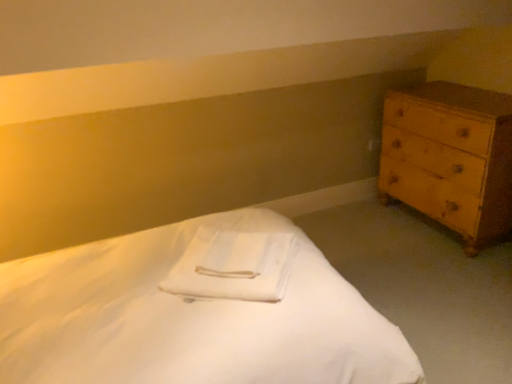
You are a GUI agent. You are given a task and a screenshot of the screen. Output one action in this format:
    pyautogui.click(x=<x>, y=<y>)
    Task: Click on the free spot to the left of light brown wooden chest of drawers at right
    The width and height of the screenshot is (512, 384).
    Given the screenshot: What is the action you would take?
    pyautogui.click(x=362, y=236)